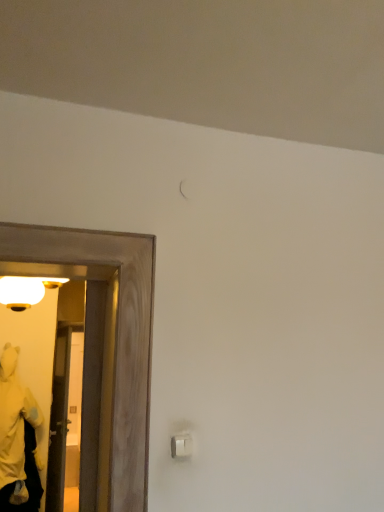
The width and height of the screenshot is (384, 512). Describe the element at coordinates (82, 396) in the screenshot. I see `transparent glass door at left` at that location.

Measure the distance between point (8,304) and camera.

Point (8,304) and camera are 7.13 feet apart.

In order to face white plastic light switch at lower right, should I rotate leftwards or rightwards?

You should rotate left by 0.755 degrees.

What do you see at coordinates (182, 445) in the screenshot? I see `white plastic light switch at lower right` at bounding box center [182, 445].

Find the location of a particular element. transparent glass door at left is located at coordinates (82, 396).

Can you confirm if transparent glass door at left is smaller than matte white globe at left?

Actually, transparent glass door at left might be larger than matte white globe at left.

Based on the photo, is transparent glass door at left taller than matte white globe at left?

Yes.

Is transparent glass door at left at the right side of matte white globe at left?

In fact, transparent glass door at left is to the left of matte white globe at left.

Does white plastic light switch at lower right lie in front of wooden door at left?

Yes, it is.

From the picture: Can you confirm if white plastic light switch at lower right is shorter than wooden door at left?

Correct, white plastic light switch at lower right is not as tall as wooden door at left.

Is white plastic light switch at lower right wider than wooden door at left?

No.

Choose the correct answer: Is white plastic light switch at lower right inside wooden door at left or outside it?

white plastic light switch at lower right is spatially situated outside wooden door at left.

Where is `light switch located in front of the matte white globe at left`? This screenshot has width=384, height=512. light switch located in front of the matte white globe at left is located at coordinates (182, 445).

Could you tell me if white plastic light switch at lower right is turned towards matte white globe at left?

No.

Is point (187, 449) behind point (20, 298)?

No, it is not.

Is white plastic light switch at lower right in front of or behind matte white globe at left in the image?

In the image, white plastic light switch at lower right appears in front of matte white globe at left.

From a real-world perspective, which object stands above the other?

matte white globe at left is physically above.

How many degrees apart are the facing directions of wooden door at left and matte white globe at left?

wooden door at left and matte white globe at left are facing 6.94 degrees away from each other.

Who is taller, wooden door at left or matte white globe at left?

wooden door at left is taller.

In terms of width, does wooden door at left look wider or thinner when compared to matte white globe at left?

Clearly, wooden door at left has more width compared to matte white globe at left.

Is matte white globe at left aimed at transparent glass door at left?

No, matte white globe at left is not aimed at transparent glass door at left.

Based on the photo, from the image's perspective, between matte white globe at left and transparent glass door at left, which one is located above?

matte white globe at left is shown above in the image.

Is transparent glass door at left surrounded by matte white globe at left?

Actually, transparent glass door at left is outside matte white globe at left.

From a real-world perspective, which object rests below the other?

In real-world perspective, transparent glass door at left is lower.

Is matte white globe at left bigger than yellow plush at left?

No.

Between point (21, 308) and point (17, 412), which one is positioned in front?

The point (21, 308) is more forward.

Which object is further away from the camera taking this photo, matte white globe at left or yellow plush at left?

yellow plush at left is further from the camera.

From a real-world perspective, is matte white globe at left located beneath yellow plush at left?

No, from a real-world perspective, matte white globe at left is not beneath yellow plush at left.

From a real-world perspective, is matte white globe at left on top of wooden door at left?

Yes, from a real-world perspective, matte white globe at left is over wooden door at left

Measure the distance from matte white globe at left to wooden door at left.

matte white globe at left is 2.25 meters away from wooden door at left.

Considering the sizes of matte white globe at left and wooden door at left in the image, is matte white globe at left bigger or smaller than wooden door at left?

Clearly, matte white globe at left is smaller in size than wooden door at left.

Considering the positions of points (35, 293) and (55, 440), is point (35, 293) farther from camera compared to point (55, 440)?

No, it is in front of (55, 440).

The image size is (384, 512). I want to click on light fixture on the right of the transparent glass door at left, so (x=25, y=290).

Where is `light switch above the wooden door at left (from the image's perspective)`? Image resolution: width=384 pixels, height=512 pixels. light switch above the wooden door at left (from the image's perspective) is located at coordinates (182, 445).

From the image, which object appears to be farther from wooden door at left, matte white globe at left or white plastic light switch at lower right?

Among the two, white plastic light switch at lower right is located further to wooden door at left.

Estimate the real-world distances between objects in this image. Which object is closer to white plastic light switch at lower right, yellow plush at left or wooden door at left?

yellow plush at left.

Based on their spatial positions, is matte white globe at left or transparent glass door at left closer to yellow plush at left?

Among the two, matte white globe at left is located nearer to yellow plush at left.

Considering their positions, is white plastic light switch at lower right positioned further to yellow plush at left than transparent glass door at left?

white plastic light switch at lower right is further to yellow plush at left.

Looking at the image, which one is located closer to wooden door at left, yellow plush at left or transparent glass door at left?

transparent glass door at left lies closer to wooden door at left than the other object.

Estimate the real-world distances between objects in this image. Which object is closer to transparent glass door at left, wooden door at left or white plastic light switch at lower right?

Based on the image, wooden door at left appears to be nearer to transparent glass door at left.

When comparing their distances from wooden door at left, does white plastic light switch at lower right or yellow plush at left seem closer?

The object closer to wooden door at left is yellow plush at left.

Based on their spatial positions, is transparent glass door at left or matte white globe at left further from wooden door at left?

Among the two, matte white globe at left is located further to wooden door at left.

This screenshot has height=512, width=384. I want to click on door positioned between matte white globe at left and transparent glass door at left from near to far, so click(x=58, y=421).

I want to click on person between white plastic light switch at lower right and wooden door at left along the z-axis, so click(14, 432).

Where is `light fixture positioned between white plastic light switch at lower right and wooden door at left from near to far`? Image resolution: width=384 pixels, height=512 pixels. light fixture positioned between white plastic light switch at lower right and wooden door at left from near to far is located at coordinates (25, 290).

Find the location of a particular element. This screenshot has height=512, width=384. person between white plastic light switch at lower right and transparent glass door at left in the front-back direction is located at coordinates (x=14, y=432).